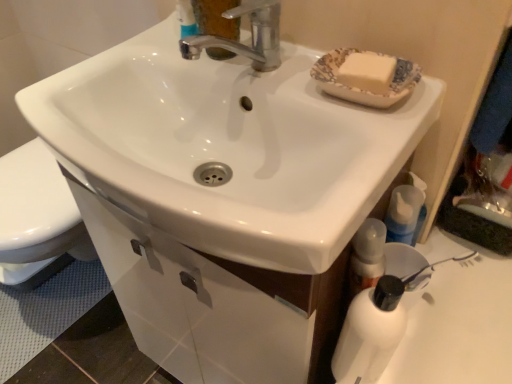
Question: In the image, is blue translucent bottle at lower right positioned in front of or behind white matte bottle at lower right?

Choices:
 (A) front
 (B) behind

Answer: (B)

Question: Considering the positions of point (411, 233) and point (365, 334), is point (411, 233) closer or farther from the camera than point (365, 334)?

Choices:
 (A) closer
 (B) farther

Answer: (B)

Question: Which object is positioned closest to the white matte bottle at lower right?

Choices:
 (A) white glossy sink at center
 (B) white glossy drawer at lower center
 (C) blue translucent bottle at lower right

Answer: (C)

Question: Which object is the closest to the blue translucent bottle at lower right?

Choices:
 (A) white glossy sink at center
 (B) white glossy drawer at lower center
 (C) white matte bottle at lower right

Answer: (C)